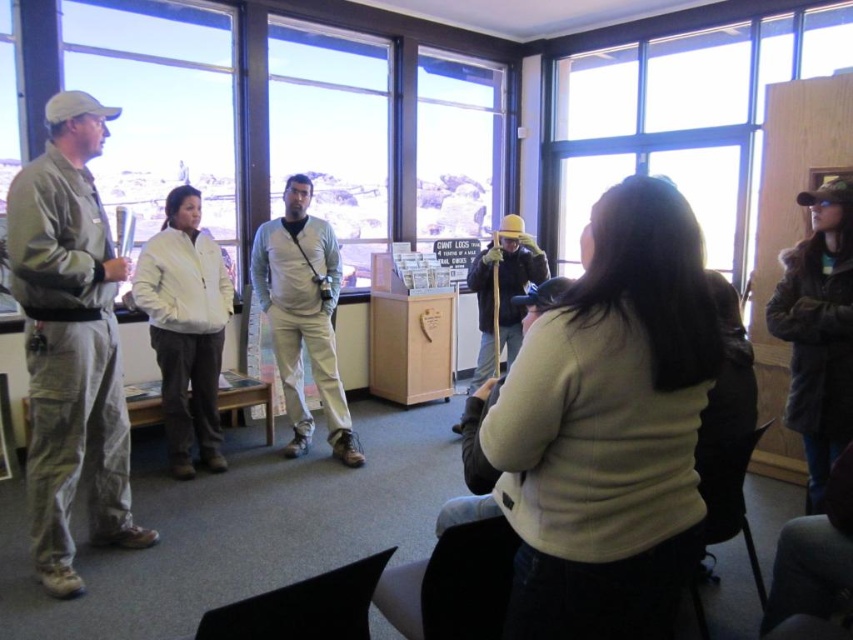
The image size is (853, 640). Identify the location of khaki cotton pants at left. (70, 342).

Who is more distant from viewer, (45, 529) or (281, 292)?

Point (281, 292)

Where is `khaki cotton pants at left`? khaki cotton pants at left is located at coordinates (70, 342).

Is point (843, 193) positioned before point (480, 264)?

That is True.

What do you see at coordinates (817, 330) in the screenshot?
I see `brown fuzzy coat at right` at bounding box center [817, 330].

This screenshot has height=640, width=853. What do you see at coordinates (817, 330) in the screenshot?
I see `brown fuzzy coat at right` at bounding box center [817, 330].

Locate an element on the screen. Image resolution: width=853 pixels, height=640 pixels. brown fuzzy coat at right is located at coordinates (817, 330).

Is light beige sweater at center closer to camera compared to white matte jacket at center?

Yes, light beige sweater at center is closer to the viewer.

Is light beige sweater at center smaller than white matte jacket at center?

Yes.

Between point (608, 401) and point (204, 464), which one is positioned in front?

Point (608, 401) is more forward.

Where is `light beige sweater at center`? light beige sweater at center is located at coordinates (608, 428).